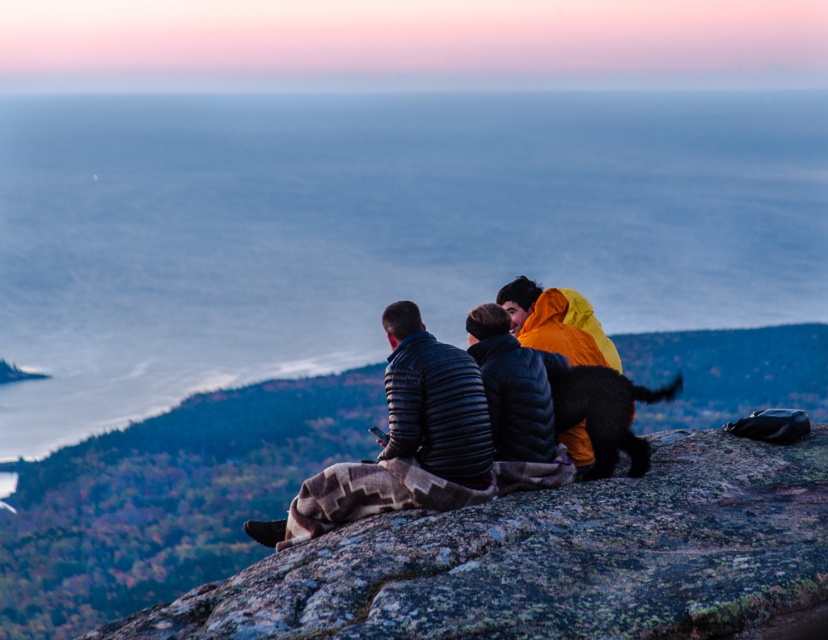
Question: Can you confirm if blue water at center is positioned above matte black jackets at center?

Choices:
 (A) yes
 (B) no

Answer: (A)

Question: Which point is closer to the camera?

Choices:
 (A) (225, 310)
 (B) (782, 632)
 (C) (480, 464)
 (D) (571, 429)

Answer: (B)

Question: Which object is the closest to the rough textured rock at center?

Choices:
 (A) matte black jackets at center
 (B) blue water at center
 (C) dark blue quilted jacket at center

Answer: (C)

Question: Which point appears closest to the camera in this image?

Choices:
 (A) (552, 298)
 (B) (436, 364)
 (C) (651, 301)
 (D) (776, 472)

Answer: (B)

Question: Can you confirm if dark blue quilted jacket at center is positioned below matte black jackets at center?

Choices:
 (A) yes
 (B) no

Answer: (A)

Question: Does dark blue quilted jacket at center have a larger size compared to matte black jackets at center?

Choices:
 (A) no
 (B) yes

Answer: (A)